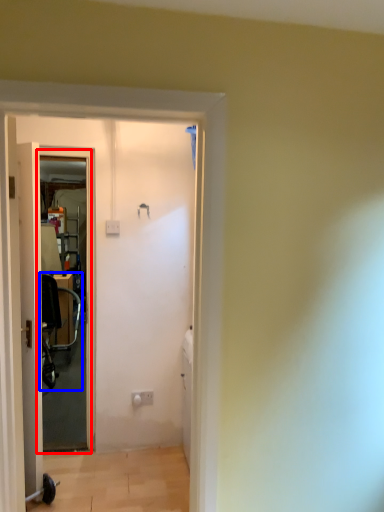
Question: Among these objects, which one is nearest to the camera, screen door (highlighted by a red box) or baby carriage (highlighted by a blue box)?

Choices:
 (A) screen door
 (B) baby carriage

Answer: (A)